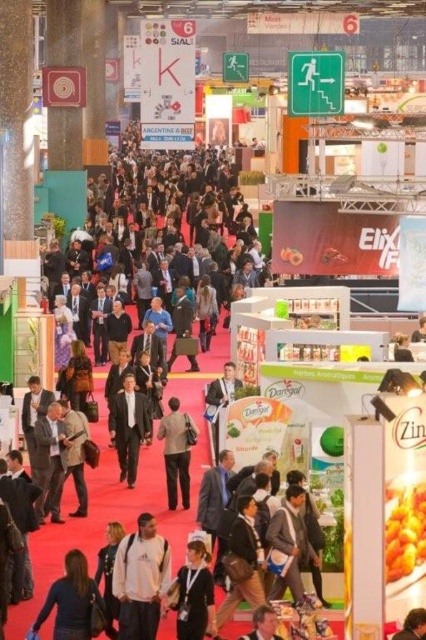
Question: Which object is farther from the camera taking this photo?

Choices:
 (A) dark suit at center
 (B) white cotton jacket at center
 (C) dark brown leather jacket at lower left

Answer: (A)

Question: Is white cotton jacket at center positioned before dark brown leather jacket at lower left?

Choices:
 (A) yes
 (B) no

Answer: (B)

Question: Which point is farther to the camera?

Choices:
 (A) 132,435
 (B) 132,634
 (C) 192,432
 (D) 83,636

Answer: (A)

Question: Is dark brown leather jacket at lower left below dark suit at center?

Choices:
 (A) yes
 (B) no

Answer: (A)

Question: Can you confirm if dark brown leather jacket at lower left is smaller than dark suit at center?

Choices:
 (A) yes
 (B) no

Answer: (B)

Question: Which object is closer to the camera taking this photo?

Choices:
 (A) black fabric jacket at center
 (B) light brown leather jacket at center
 (C) white cotton jacket at center
 (D) dark suit at center

Answer: (A)